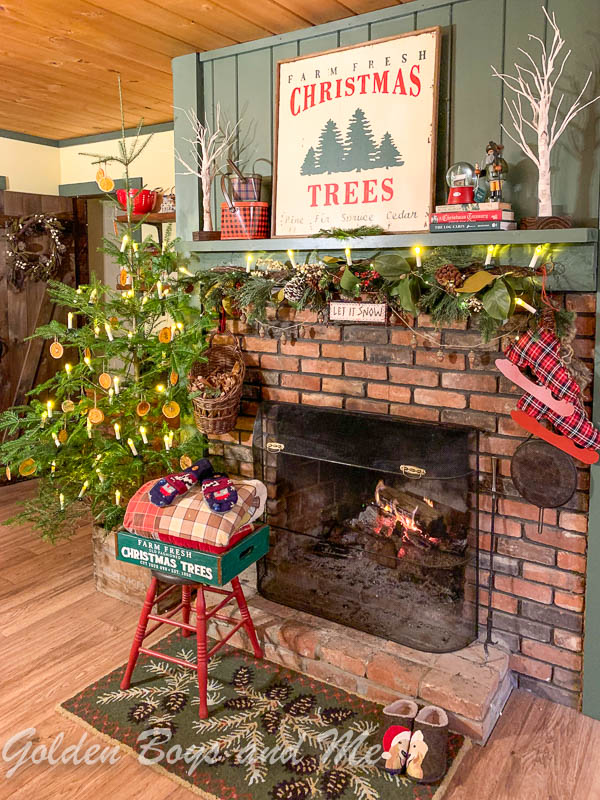
This screenshot has width=600, height=800. I want to click on length of sage shelf, so click(x=180, y=245), click(x=584, y=236).